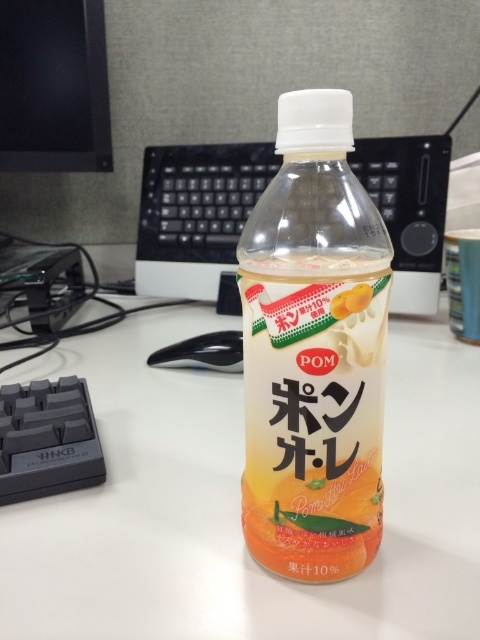
Question: Which of the following is the closest to the observer?

Choices:
 (A) black glossy monitor at upper left
 (B) white plastic table at center
 (C) translucent plastic bottle at center

Answer: (C)

Question: Does white plastic table at center appear under translucent plastic bottle at center?

Choices:
 (A) yes
 (B) no

Answer: (B)

Question: Is transparent plastic bottle at center bigger than orange matte peach at bottle center?

Choices:
 (A) yes
 (B) no

Answer: (A)

Question: Which point is farther to the camera?

Choices:
 (A) (37, 636)
 (B) (35, 140)
 (C) (282, 113)

Answer: (B)

Question: Is black plastic keyboard at lower left behind orange matte peach at bottle center?

Choices:
 (A) no
 (B) yes

Answer: (B)

Question: Which of the following is the farthest from the observer?

Choices:
 (A) (335, 312)
 (B) (188, 499)
 (C) (215, 173)

Answer: (C)